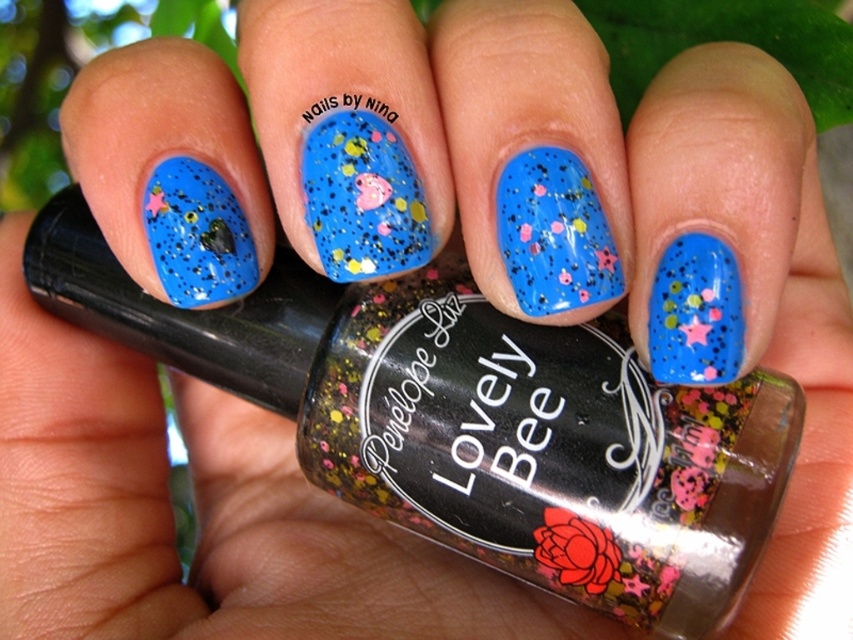
Question: Can you confirm if glittery blue nail art with colorful speckles at center is positioned to the right of glittery blue nail at center?

Choices:
 (A) no
 (B) yes

Answer: (A)

Question: Which point is closer to the camera?

Choices:
 (A) glittery blue nail at center
 (B) glittery blue nail art with colorful speckles at center

Answer: (A)

Question: Which of the following is the closest to the observer?

Choices:
 (A) (352, 227)
 (B) (575, 188)

Answer: (B)

Question: Does glittery blue nail art with colorful speckles at center appear on the right side of glittery blue nail at center?

Choices:
 (A) yes
 (B) no

Answer: (B)

Question: In this image, where is glittery blue nail art with colorful speckles at center located relative to glittery blue nail at center?

Choices:
 (A) below
 (B) above

Answer: (B)